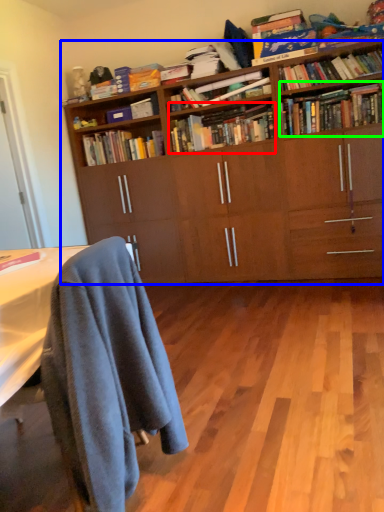
Question: Which object is the farthest from book (highlighted by a red box)? Choose among these: bookcase (highlighted by a blue box) or book (highlighted by a green box).

Choices:
 (A) bookcase
 (B) book

Answer: (B)